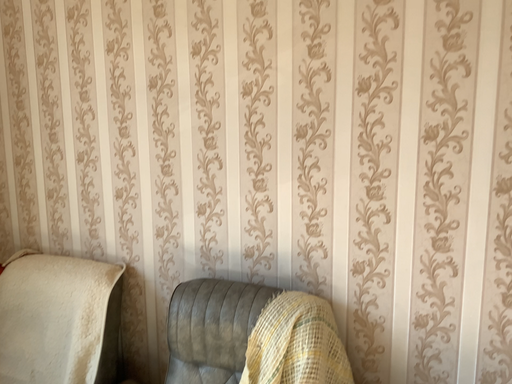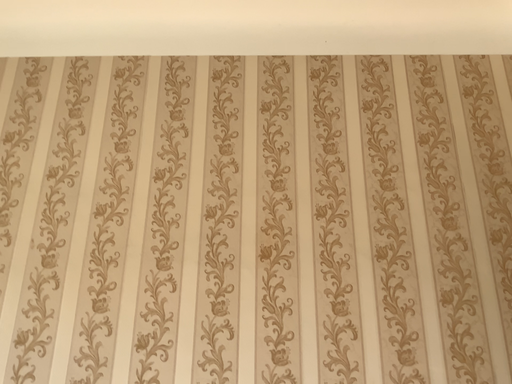
Question: How did the camera likely rotate when shooting the video?

Choices:
 (A) rotated right
 (B) rotated left

Answer: (A)